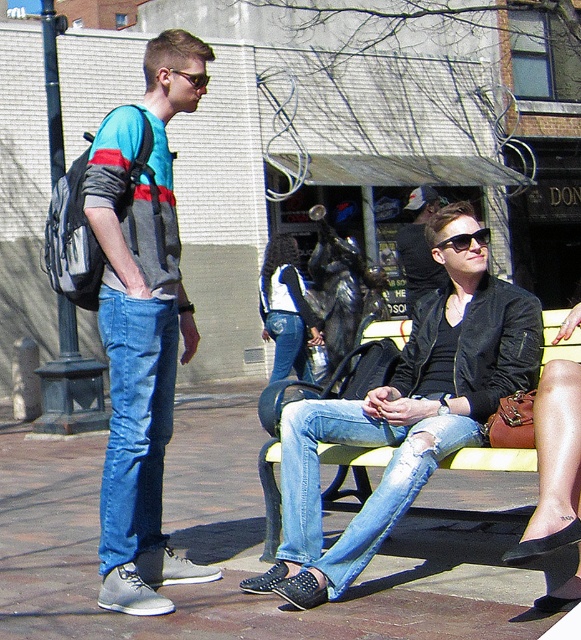
Question: Is ripped denim jeans at center thinner than denim jacket at center?

Choices:
 (A) no
 (B) yes

Answer: (A)

Question: Which point is farther to the camera?

Choices:
 (A) (290, 349)
 (B) (437, 269)
 (C) (263, 320)

Answer: (C)

Question: Does matte blue jeans at left appear under ripped denim jeans at center?

Choices:
 (A) yes
 (B) no

Answer: (B)

Question: Among these objects, which one is farthest from the camera?

Choices:
 (A) matte blue jeans at left
 (B) yellow wood bench at center

Answer: (B)

Question: Can you confirm if leather jacket at center is positioned below denim jeans at center?

Choices:
 (A) no
 (B) yes

Answer: (A)

Question: Which point is farther to the camera?

Choices:
 (A) (410, 266)
 (B) (159, 532)
 (C) (299, 369)
 (D) (120, 372)

Answer: (C)